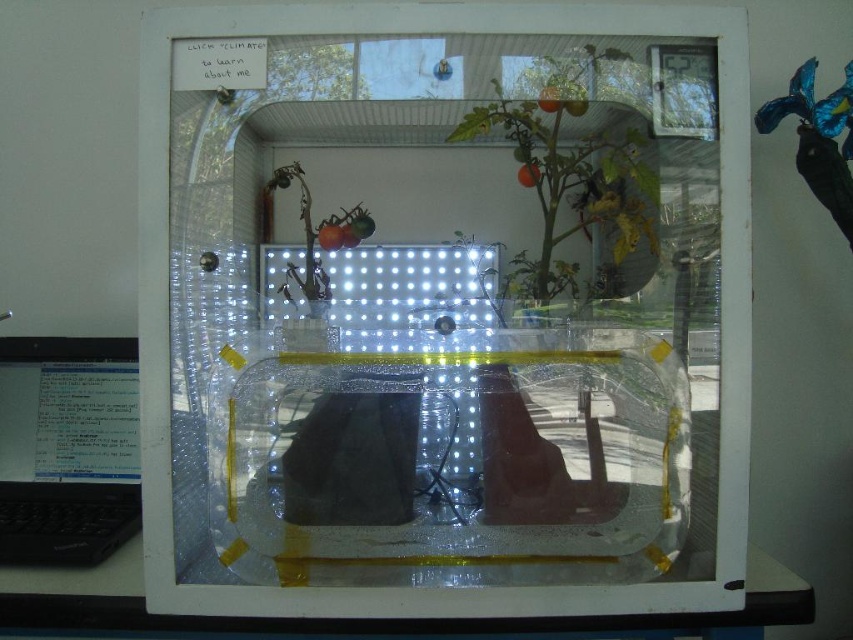
You are a gardener who wants to ensure sunlight reaches all parts of the tomato plants in the greenhouse. Since the transparent plastic window at center is the only source of natural light, where should you position the plants relative to it to maximize light exposure?

The transparent plastic window at center is located at point (444,314), so positioning the plants symmetrically around this central point would ensure maximum light exposure from the window.

You are a gardener who wants to check the growth of the green matte plant at center. Since you can only reach up to 1.5 meters, can you access the plant without any tools? Please consider the transparent plastic window at center in your answer.

The transparent plastic window at center is closer to the viewer than the green matte plant at center, so the plant is behind the window. Since the window is in front, you would need to reach through or around it to access the plant. However, without knowing the exact height of the window or the plant, it is impossible to determine if you can reach the plant within your 1.5 meters limit. More information about their heights is needed.